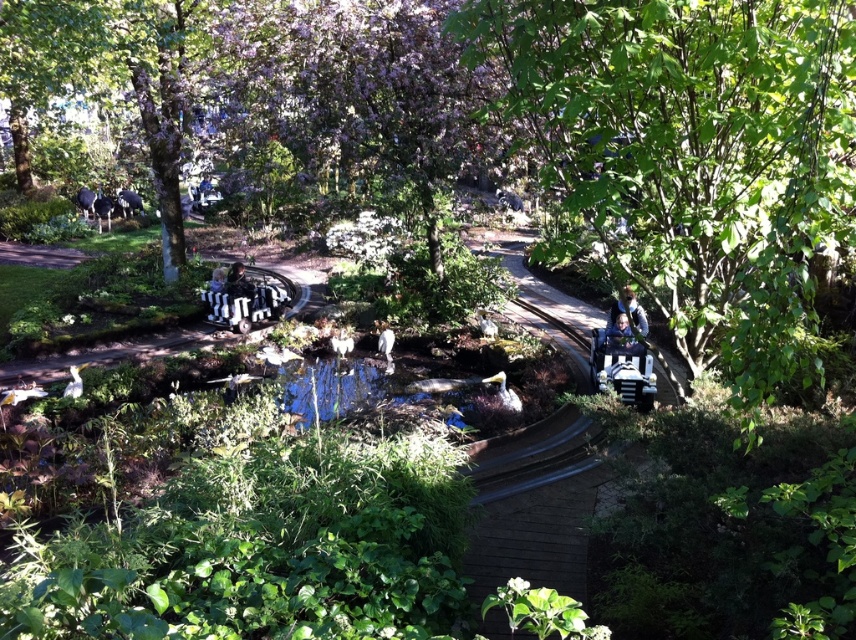
Between green leafy tree at center and smooth black car at center, which one appears on the right side from the viewer's perspective?

green leafy tree at center

What do you see at coordinates (694, 154) in the screenshot? I see `green leafy tree at center` at bounding box center [694, 154].

Which is behind, point (621, 118) or point (239, 260)?

Point (239, 260)

Where is `green leafy tree at center`? The height and width of the screenshot is (640, 856). green leafy tree at center is located at coordinates (694, 154).

Does blue denim jacket at upper right have a greater height compared to blue fabric jacket at center?

Yes, blue denim jacket at upper right is taller than blue fabric jacket at center.

Is point (631, 298) less distant than point (627, 333)?

Yes, point (631, 298) is in front of point (627, 333).

The image size is (856, 640). Find the location of `blue denim jacket at upper right`. blue denim jacket at upper right is located at coordinates (628, 310).

Find the location of a particular element. The image size is (856, 640). green leafy tree at center is located at coordinates (694, 154).

What do you see at coordinates (694, 154) in the screenshot? This screenshot has height=640, width=856. I see `green leafy tree at center` at bounding box center [694, 154].

Measure the distance between point (841,88) and camera.

They are 2.61 meters apart.

This screenshot has width=856, height=640. What are the coordinates of `green leafy tree at center` in the screenshot? It's located at (694, 154).